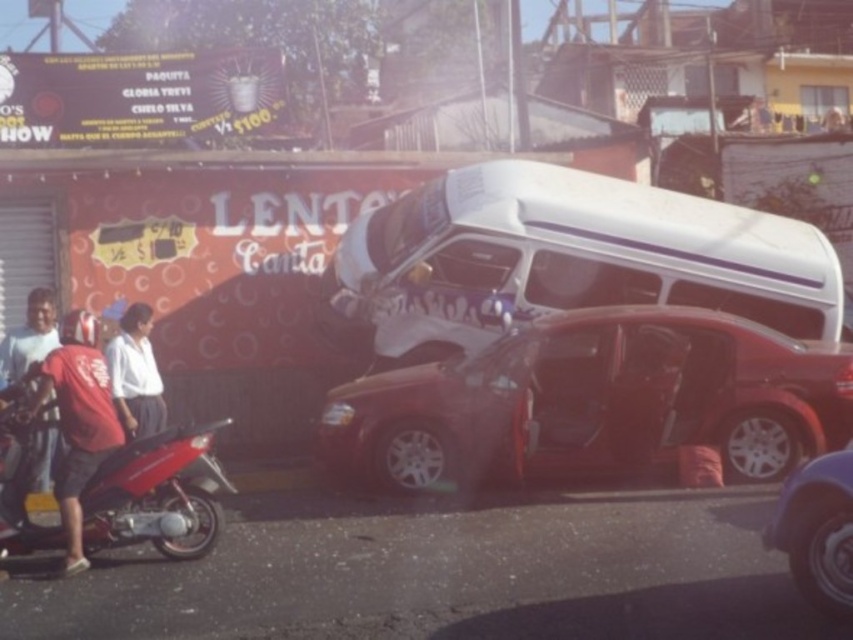
Question: Is red cotton shirt at left further to the viewer compared to shiny blue car at lower right?

Choices:
 (A) no
 (B) yes

Answer: (B)

Question: Which point is farther from the camera taking this photo?

Choices:
 (A) (85, 376)
 (B) (815, 388)
 (C) (26, 332)

Answer: (C)

Question: Does shiny red sedan at center have a smaller size compared to white matte shirt at center?

Choices:
 (A) yes
 (B) no

Answer: (B)

Question: Among these points, which one is nearest to the camera?

Choices:
 (A) [x=624, y=317]
 (B) [x=109, y=349]
 (C) [x=53, y=349]
 (D) [x=849, y=609]

Answer: (D)

Question: Which point is closer to the camera taking this photo?

Choices:
 (A) (846, 461)
 (B) (68, 417)
 (C) (142, 451)
 (D) (535, 188)

Answer: (A)

Question: Can you confirm if white glossy van at center is positioned below shiny blue car at lower right?

Choices:
 (A) no
 (B) yes

Answer: (A)